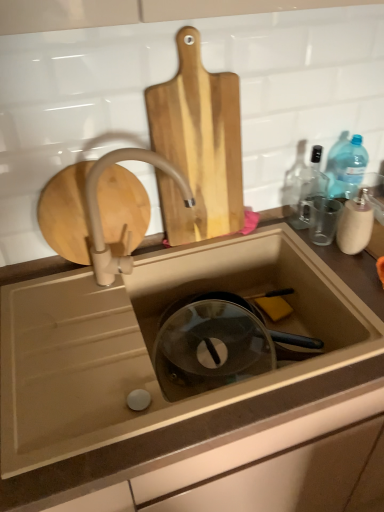
Question: Should I look upward or downward to see natural wood cutting board at upper center?

Choices:
 (A) up
 (B) down

Answer: (A)

Question: Is natural wood cutting board at upper center at the left side of white matte faucet at upper center?

Choices:
 (A) yes
 (B) no

Answer: (B)

Question: Can you confirm if natural wood cutting board at upper center is positioned to the right of white matte faucet at upper center?

Choices:
 (A) yes
 (B) no

Answer: (A)

Question: From the image's perspective, does natural wood cutting board at upper center appear higher than white matte faucet at upper center?

Choices:
 (A) no
 (B) yes

Answer: (B)

Question: Does natural wood cutting board at upper center have a greater height compared to white matte faucet at upper center?

Choices:
 (A) no
 (B) yes

Answer: (B)

Question: Is natural wood cutting board at upper center positioned beyond the bounds of white matte faucet at upper center?

Choices:
 (A) yes
 (B) no

Answer: (A)

Question: From a real-world perspective, is natural wood cutting board at upper center located beneath white matte faucet at upper center?

Choices:
 (A) yes
 (B) no

Answer: (B)

Question: Does transparent glass bottle at upper right appear on the right side of white matte faucet at upper center?

Choices:
 (A) yes
 (B) no

Answer: (A)

Question: Is transparent glass bottle at upper right closer to the viewer compared to white matte faucet at upper center?

Choices:
 (A) no
 (B) yes

Answer: (A)

Question: Can you confirm if transparent glass bottle at upper right is thinner than white matte faucet at upper center?

Choices:
 (A) no
 (B) yes

Answer: (B)

Question: Can you confirm if transparent glass bottle at upper right is smaller than white matte faucet at upper center?

Choices:
 (A) no
 (B) yes

Answer: (B)

Question: Would you say white matte faucet at upper center is part of transparent glass bottle at upper right's contents?

Choices:
 (A) no
 (B) yes

Answer: (A)

Question: Is transparent glass bottle at upper right positioned far away from white matte faucet at upper center?

Choices:
 (A) yes
 (B) no

Answer: (B)

Question: Is transparent glass bottle at upper right with translucent plastic sink at center?

Choices:
 (A) no
 (B) yes

Answer: (A)